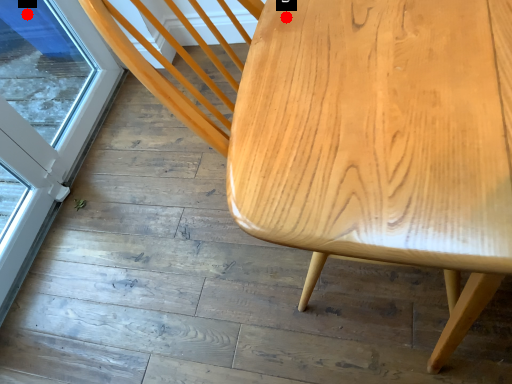
Question: Two points are circled on the image, labeled by A and B beside each circle. Among these points, which one is farthest from the camera?

Choices:
 (A) A is further
 (B) B is further

Answer: (A)